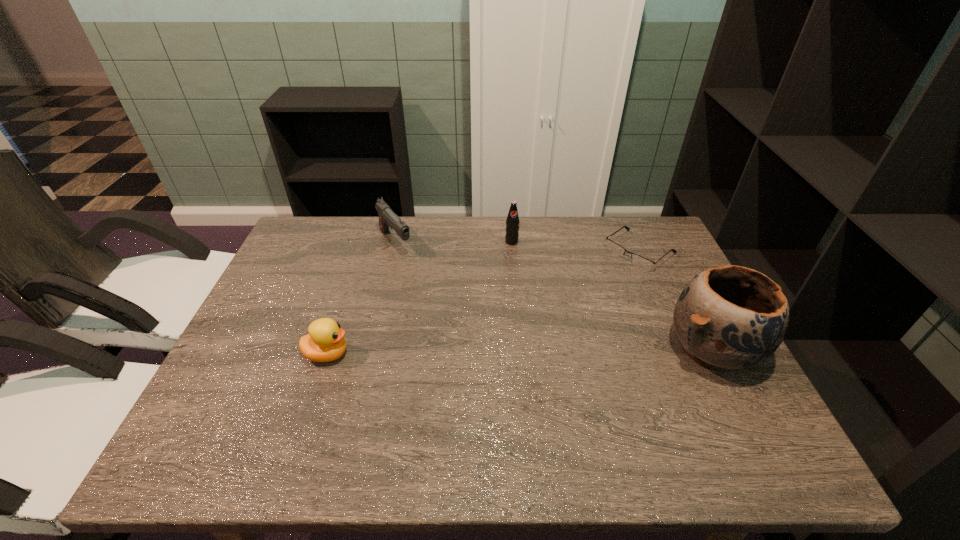
At what (x,y) coordinates should I click in order to perform the action: click on free space between the gun and the duckling. Please return your answer as a coordinate pair (x, y). Image resolution: width=960 pixels, height=540 pixels. Looking at the image, I should click on (362, 299).

Locate an element on the screen. This screenshot has height=540, width=960. object that stands as the second closest to the tallest object is located at coordinates (512, 222).

Identify which object is located as the nearest to the third object from left to right. Please provide its 2D coordinates. Your answer should be formatted as a tuple, i.e. [(x, y)], where the tuple contains the x and y coordinates of a point satisfying the conditions above.

[(639, 261)]